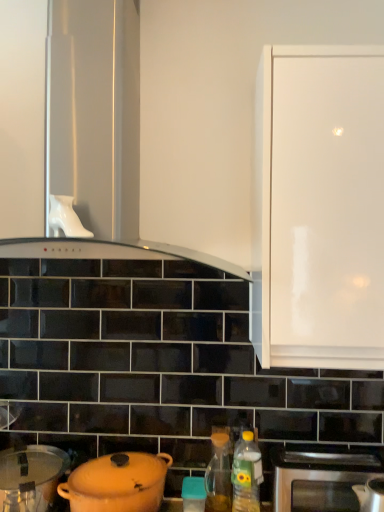
Describe the element at coordinates (321, 476) in the screenshot. The width and height of the screenshot is (384, 512). I see `stainless steel oven at lower right` at that location.

What are the coordinates of `stainless steel kettle at lower right, which ranks as the third kitchen appliance in left-to-right order` in the screenshot? It's located at (370, 495).

What is the approximate height of white glossy range hood at upper center?

35.50 inches.

What do you see at coordinates (321, 208) in the screenshot? I see `white glossy cabinet at upper right` at bounding box center [321, 208].

This screenshot has height=512, width=384. In order to click on stainless steel oven at lower right in this screenshot , I will do `click(321, 476)`.

Is stainless steel kettle at lower right, the 1th kitchen appliance when ordered from right to left, facing towards stainless steel oven at lower right?

No, stainless steel kettle at lower right, the 1th kitchen appliance when ordered from right to left, is not turned towards stainless steel oven at lower right.

Is stainless steel kettle at lower right, which ranks as the third kitchen appliance in left-to-right order, further to the viewer compared to stainless steel oven at lower right?

No, stainless steel kettle at lower right, which ranks as the third kitchen appliance in left-to-right order, is in front of stainless steel oven at lower right.

Based on the photo, from a real-world perspective, is stainless steel kettle at lower right, which ranks as the third kitchen appliance in left-to-right order, below stainless steel oven at lower right?

No, from a real-world perspective, stainless steel kettle at lower right, which ranks as the third kitchen appliance in left-to-right order, is not under stainless steel oven at lower right.

How different are the orientations of stainless steel kettle at lower right, which ranks as the third kitchen appliance in left-to-right order, and stainless steel oven at lower right in degrees?

There is a 0.16-degree angle between the facing directions of stainless steel kettle at lower right, which ranks as the third kitchen appliance in left-to-right order, and stainless steel oven at lower right.

Considering the sizes of translucent plastic bottle at lower right, which is the first bottle from right to left, and matte plastic container at center in the image, is translucent plastic bottle at lower right, which is the first bottle from right to left, wider or thinner than matte plastic container at center?

Clearly, translucent plastic bottle at lower right, which is the first bottle from right to left, has less width compared to matte plastic container at center.

From a real-world perspective, who is located higher, translucent plastic bottle at lower right, which is the first bottle from right to left, or matte plastic container at center?

In real-world perspective, translucent plastic bottle at lower right, which is the first bottle from right to left, is above.

Is translucent plastic bottle at lower right, the second bottle when ordered from back to front, touching matte plastic container at center?

No, translucent plastic bottle at lower right, the second bottle when ordered from back to front, is not touching matte plastic container at center.

Between translucent plastic bottle at lower right, which appears as the 1th bottle when viewed from the front, and matte plastic container at center, which one appears on the left side from the viewer's perspective?

matte plastic container at center is more to the left.

Between white glossy range hood at upper center and matte orange pot at lower left, the first kitchen appliance in the left-to-right sequence, which one has larger size?

white glossy range hood at upper center is bigger.

Would you consider white glossy range hood at upper center to be distant from matte orange pot at lower left, the first kitchen appliance in the left-to-right sequence?

That's not correct — white glossy range hood at upper center is a little close to matte orange pot at lower left, the first kitchen appliance in the left-to-right sequence.

From a real-world perspective, is white glossy range hood at upper center on top of matte orange pot at lower left, the first kitchen appliance in the left-to-right sequence?

Indeed, from a real-world perspective, white glossy range hood at upper center stands above matte orange pot at lower left, the first kitchen appliance in the left-to-right sequence.

Is white glossy range hood at upper center in front of or behind matte orange pot at lower left, the third kitchen appliance from the right, in the image?

Visually, white glossy range hood at upper center is located in front of matte orange pot at lower left, the third kitchen appliance from the right.

Which point is more forward, (230, 493) or (233, 475)?

Positioned in front is point (233, 475).

Can you confirm if translucent glass oil at lower center, marked as the second bottle in a right-to-left arrangement, is shorter than translucent plastic bottle at lower right, which appears as the 1th bottle when viewed from the front?

Yes.

Is translucent glass oil at lower center, which is the first bottle from back to front, wider than translucent plastic bottle at lower right, the second bottle when ordered from back to front?

Correct, the width of translucent glass oil at lower center, which is the first bottle from back to front, exceeds that of translucent plastic bottle at lower right, the second bottle when ordered from back to front.

Would you consider matte yellow pot at lower left, which appears as the second kitchen appliance when viewed from the right, to be distant from stainless steel kettle at lower right, which ranks as the third kitchen appliance in left-to-right order?

No, matte yellow pot at lower left, which appears as the second kitchen appliance when viewed from the right, is not far from stainless steel kettle at lower right, which ranks as the third kitchen appliance in left-to-right order.

Does point (164, 463) come in front of point (365, 501)?

No, (164, 463) is behind (365, 501).

Between matte yellow pot at lower left, which is counted as the 2th kitchen appliance, starting from the left, and stainless steel kettle at lower right, which ranks as the third kitchen appliance in left-to-right order, which one has larger width?

With larger width is matte yellow pot at lower left, which is counted as the 2th kitchen appliance, starting from the left.

Is matte yellow pot at lower left, which is counted as the 2th kitchen appliance, starting from the left, bigger or smaller than stainless steel kettle at lower right, which ranks as the third kitchen appliance in left-to-right order?

Clearly, matte yellow pot at lower left, which is counted as the 2th kitchen appliance, starting from the left, is larger in size than stainless steel kettle at lower right, which ranks as the third kitchen appliance in left-to-right order.

In the scene shown: Who is taller, stainless steel kettle at lower right, which ranks as the third kitchen appliance in left-to-right order, or matte plastic container at center?

stainless steel kettle at lower right, which ranks as the third kitchen appliance in left-to-right order, is taller.

From the image's perspective, is stainless steel kettle at lower right, which ranks as the third kitchen appliance in left-to-right order, on matte plastic container at center?

Correct, stainless steel kettle at lower right, which ranks as the third kitchen appliance in left-to-right order, appears higher than matte plastic container at center in the image.

From a real-world perspective, is stainless steel kettle at lower right, the 1th kitchen appliance when ordered from right to left, over matte plastic container at center?

Yes.

Is stainless steel kettle at lower right, which ranks as the third kitchen appliance in left-to-right order, in contact with matte plastic container at center?

stainless steel kettle at lower right, which ranks as the third kitchen appliance in left-to-right order, and matte plastic container at center are not in contact.

Based on the photo, from the image's perspective, relative to stainless steel kettle at lower right, the 1th kitchen appliance when ordered from right to left, is stainless steel oven at lower right above or below?

Clearly, from the image's perspective, stainless steel oven at lower right is below stainless steel kettle at lower right, the 1th kitchen appliance when ordered from right to left.

Is stainless steel oven at lower right shorter than stainless steel kettle at lower right, the 1th kitchen appliance when ordered from right to left?

Yes, stainless steel oven at lower right is shorter than stainless steel kettle at lower right, the 1th kitchen appliance when ordered from right to left.

Looking at the image, does stainless steel oven at lower right seem bigger or smaller compared to stainless steel kettle at lower right, the 1th kitchen appliance when ordered from right to left?

stainless steel oven at lower right is bigger than stainless steel kettle at lower right, the 1th kitchen appliance when ordered from right to left.

Is stainless steel oven at lower right positioned beyond the bounds of stainless steel kettle at lower right, which ranks as the third kitchen appliance in left-to-right order?

Absolutely, stainless steel oven at lower right is external to stainless steel kettle at lower right, which ranks as the third kitchen appliance in left-to-right order.

Identify the location of oven below the stainless steel kettle at lower right, the 1th kitchen appliance when ordered from right to left (from the image's perspective). The width and height of the screenshot is (384, 512). (321, 476).

This screenshot has width=384, height=512. What are the coordinates of `appliance on the left of translucent plastic bottle at lower right, the second bottle when ordered from back to front` in the screenshot? It's located at (193, 494).

Estimate the real-world distances between objects in this image. Which object is closer to white glossy range hood at upper center, stainless steel oven at lower right or matte orange pot at lower left, the third kitchen appliance from the right?

matte orange pot at lower left, the third kitchen appliance from the right, lies closer to white glossy range hood at upper center than the other object.

Looking at the image, which one is located further to stainless steel kettle at lower right, the 1th kitchen appliance when ordered from right to left, matte plastic container at center or white glossy cabinet at upper right?

white glossy cabinet at upper right is further to stainless steel kettle at lower right, the 1th kitchen appliance when ordered from right to left.

Considering their positions, is matte yellow pot at lower left, which is counted as the 2th kitchen appliance, starting from the left, positioned further to translucent plastic bottle at lower right, the second bottle when ordered from back to front, than white glossy range hood at upper center?

white glossy range hood at upper center is further to translucent plastic bottle at lower right, the second bottle when ordered from back to front.

Which object lies further to the anchor point matte orange pot at lower left, the third kitchen appliance from the right, stainless steel kettle at lower right, the 1th kitchen appliance when ordered from right to left, or translucent glass oil at lower center, which appears as the 1th bottle when viewed from the left?

stainless steel kettle at lower right, the 1th kitchen appliance when ordered from right to left, is further to matte orange pot at lower left, the third kitchen appliance from the right.

Which object lies nearer to the anchor point matte yellow pot at lower left, which appears as the second kitchen appliance when viewed from the right, white glossy range hood at upper center or matte plastic container at center?

The object closer to matte yellow pot at lower left, which appears as the second kitchen appliance when viewed from the right, is matte plastic container at center.

Based on their spatial positions, is translucent glass oil at lower center, which is the first bottle from back to front, or matte plastic container at center further from matte orange pot at lower left, the third kitchen appliance from the right?

The object further to matte orange pot at lower left, the third kitchen appliance from the right, is translucent glass oil at lower center, which is the first bottle from back to front.

Which object lies nearer to the anchor point translucent glass oil at lower center, marked as the second bottle in a right-to-left arrangement, stainless steel kettle at lower right, which ranks as the third kitchen appliance in left-to-right order, or white glossy cabinet at upper right?

stainless steel kettle at lower right, which ranks as the third kitchen appliance in left-to-right order.

When comparing their distances from stainless steel kettle at lower right, which ranks as the third kitchen appliance in left-to-right order, does translucent plastic bottle at lower right, which is the first bottle from right to left, or white glossy range hood at upper center seem closer?

Based on the image, translucent plastic bottle at lower right, which is the first bottle from right to left, appears to be nearer to stainless steel kettle at lower right, which ranks as the third kitchen appliance in left-to-right order.

Where is `bottle between white glossy range hood at upper center and matte yellow pot at lower left, which is counted as the 2th kitchen appliance, starting from the left, in the up-down direction`? bottle between white glossy range hood at upper center and matte yellow pot at lower left, which is counted as the 2th kitchen appliance, starting from the left, in the up-down direction is located at coordinates (246, 475).

The height and width of the screenshot is (512, 384). In order to click on oven between white glossy range hood at upper center and matte plastic container at center in the up-down direction in this screenshot , I will do `click(321, 476)`.

Locate an element on the screen. kitchen appliance between white glossy cabinet at upper right and matte orange pot at lower left, the third kitchen appliance from the right, in the up-down direction is located at coordinates (118, 483).

Locate an element on the screen. This screenshot has width=384, height=512. kitchen appliance between white glossy range hood at upper center and translucent glass oil at lower center, which appears as the 1th bottle when viewed from the left, in the up-down direction is located at coordinates (118, 483).